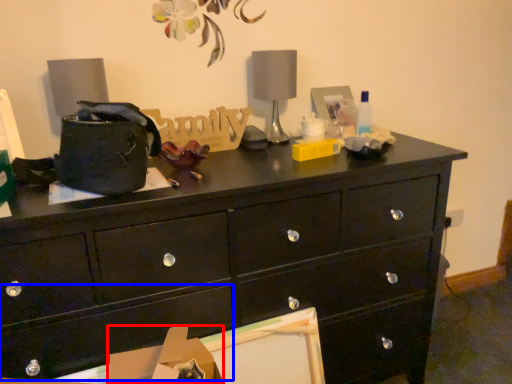
Question: Which object is closer to the camera taking this photo, cardboard box (highlighted by a red box) or drawer (highlighted by a blue box)?

Choices:
 (A) cardboard box
 (B) drawer

Answer: (B)